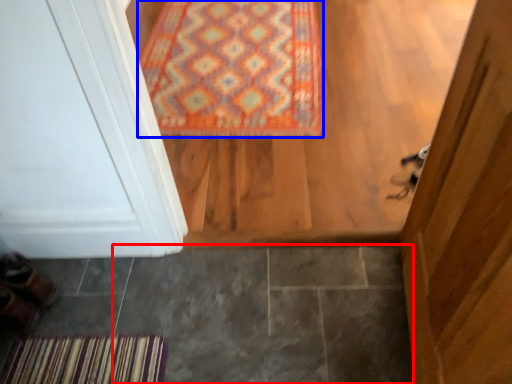
Question: Which point is closer to the camera, tile (highlighted by a red box) or mat (highlighted by a blue box)?

Choices:
 (A) tile
 (B) mat

Answer: (A)